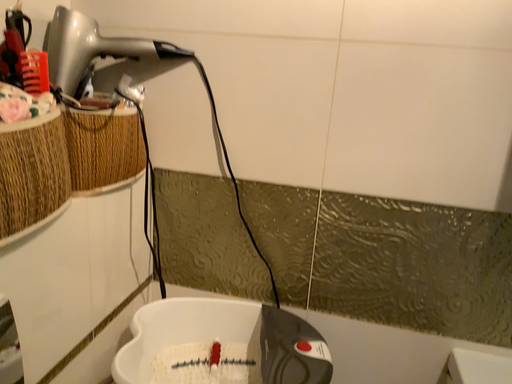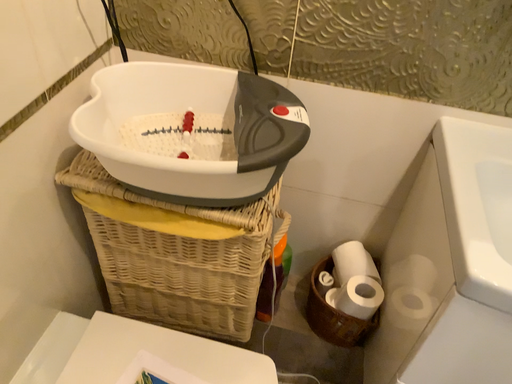
Question: Which way did the camera rotate in the video?

Choices:
 (A) rotated upward
 (B) rotated downward

Answer: (B)